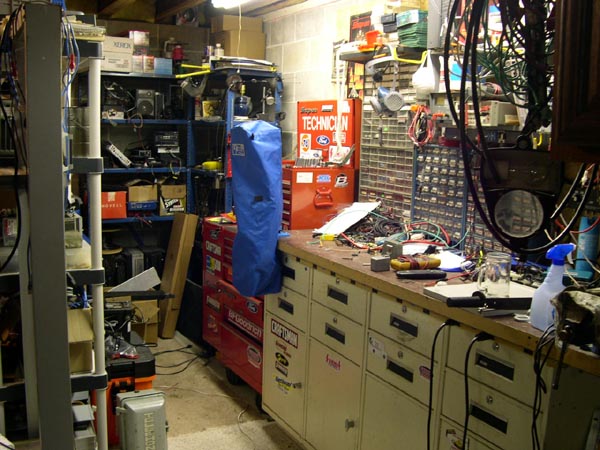
The image size is (600, 450). I want to click on white cabinet bigger doors, so click(x=285, y=373), click(x=349, y=414), click(x=405, y=429), click(x=447, y=439).